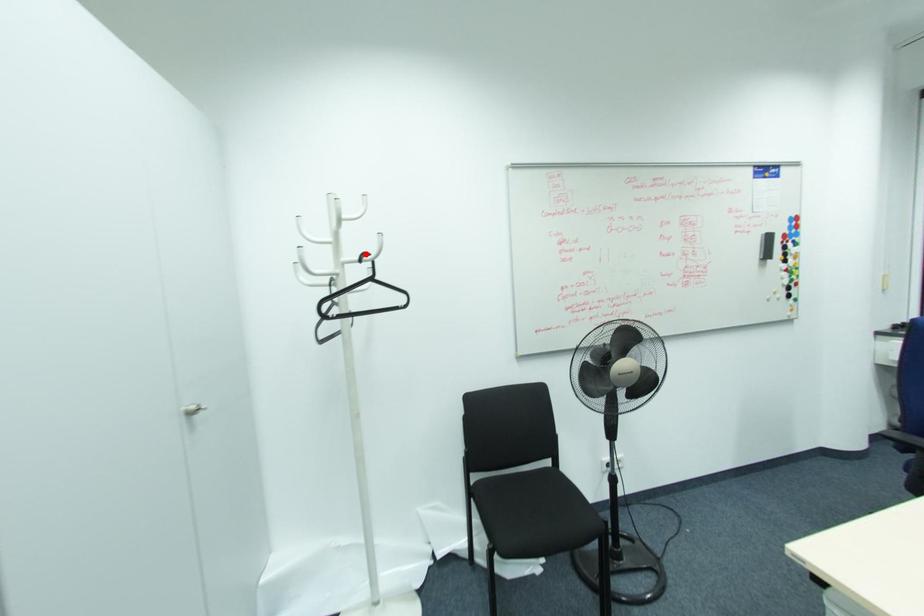
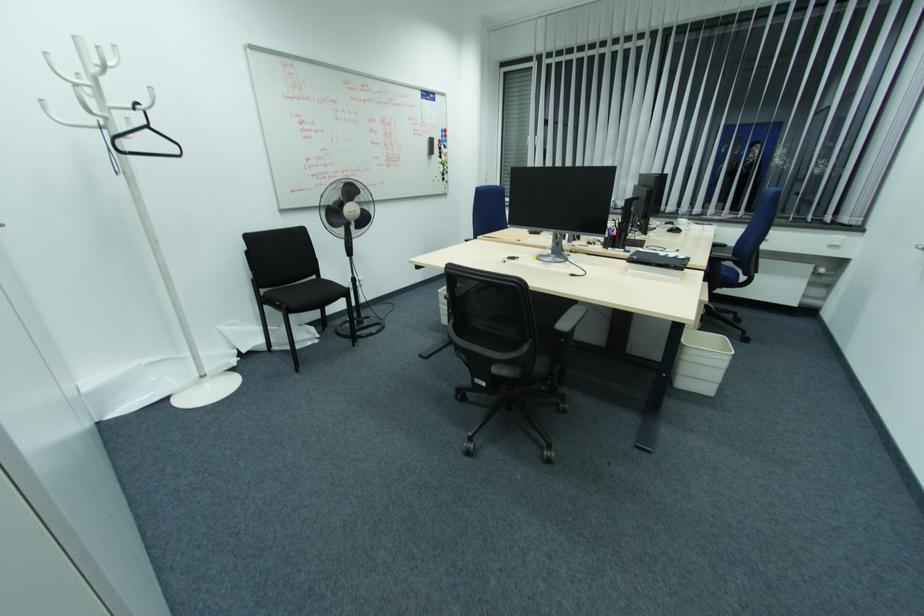
Find the pixel in the second image that matches the highlighted location in the first image.

(139, 105)